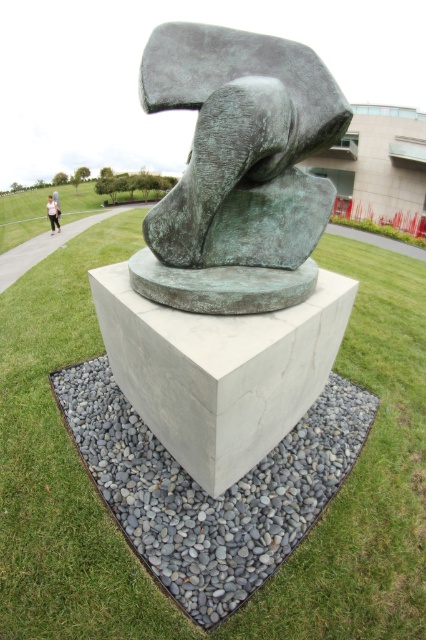
Question: Which point is farther to the camera?

Choices:
 (A) (285, 550)
 (B) (190, 227)

Answer: (B)

Question: Observing the image, what is the correct spatial positioning of gray concrete block at center in reference to light pink fabric at lower left?

Choices:
 (A) above
 (B) below

Answer: (B)

Question: Can you confirm if green grass at center is bigger than light pink fabric at lower left?

Choices:
 (A) yes
 (B) no

Answer: (B)

Question: Which of the following is the farthest from the observer?

Choices:
 (A) gray concrete block at center
 (B) gray/pebble bed at center
 (C) green grass at center
 (D) light pink fabric at lower left

Answer: (D)

Question: Based on their relative distances, which object is farther from the green patina stone sculpture at center?

Choices:
 (A) light pink fabric at lower left
 (B) green grass at center
 (C) gray/pebble bed at center

Answer: (A)

Question: Can you confirm if gray/pebble bed at center is wider than light pink fabric at lower left?

Choices:
 (A) no
 (B) yes

Answer: (A)